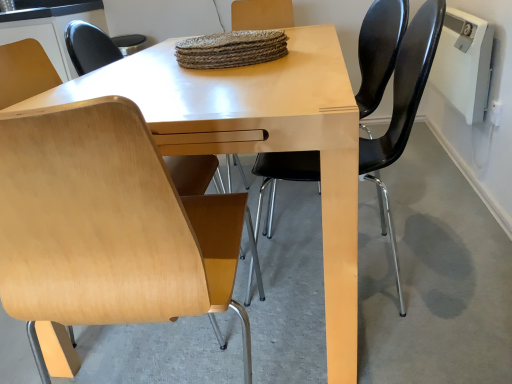
Locate an element on the screen. unoccupied area in front of black leather chair at right, positioned as the second chair in left-to-right order is located at coordinates (394, 344).